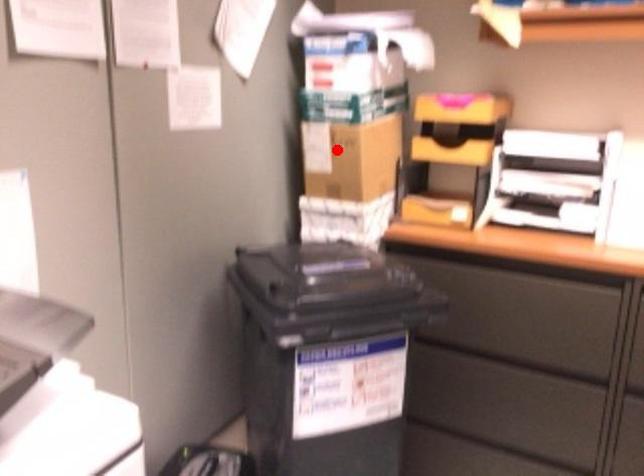
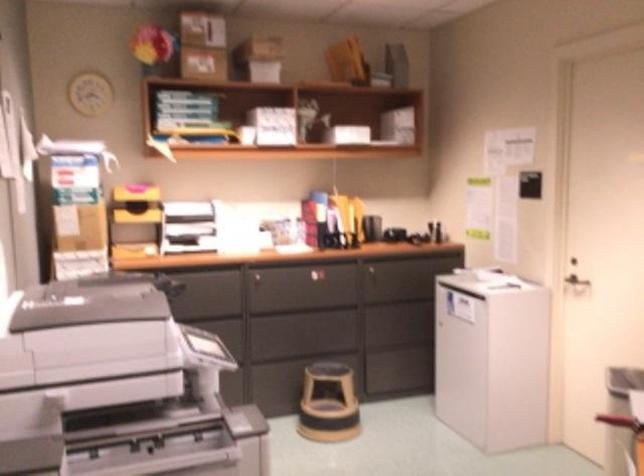
Where in the second image is the point corresponding to the highlighted location from the first image?

(78, 227)